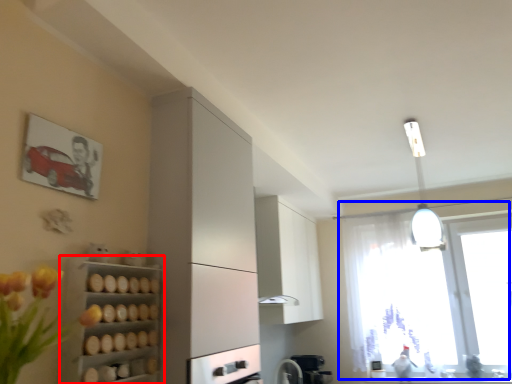
Question: Which of the following is the farthest to the observer, shelf (highlighted by a red box) or window (highlighted by a blue box)?

Choices:
 (A) shelf
 (B) window

Answer: (B)